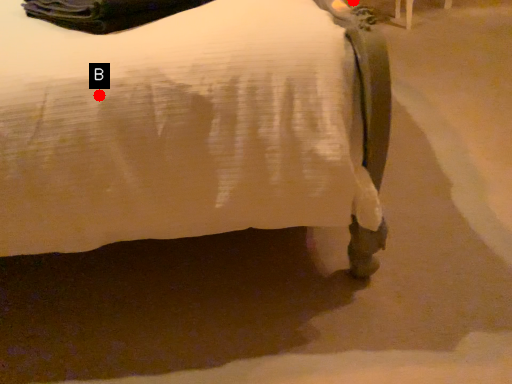
Question: Two points are circled on the image, labeled by A and B beside each circle. Which of the following is the farthest from the observer?

Choices:
 (A) A is further
 (B) B is further

Answer: (A)